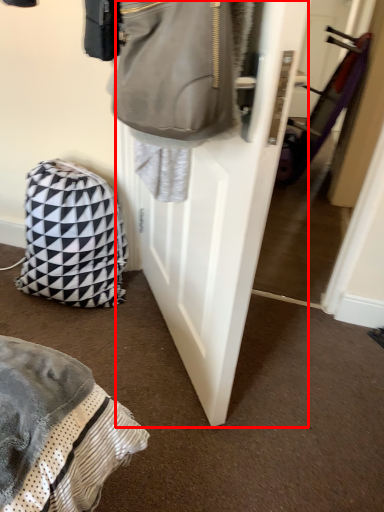
Question: Considering the relative positions of door (annotated by the red box) and backpack in the image provided, where is door (annotated by the red box) located with respect to the staircase?

Choices:
 (A) left
 (B) right

Answer: (B)